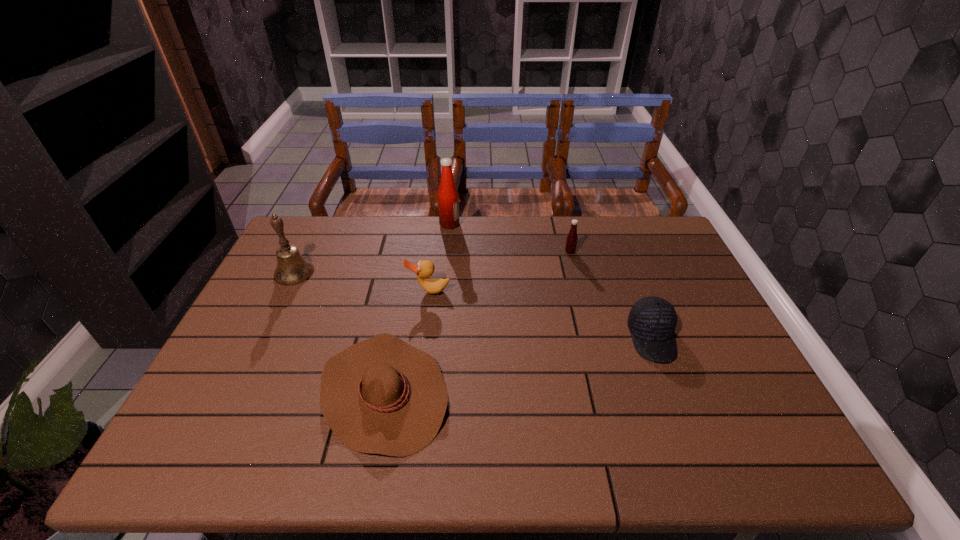
Locate an element on the screen. vacant space located 0.050m on the beak of the duck is located at coordinates (426, 309).

This screenshot has width=960, height=540. I want to click on free space located at the front of the rightmost object where the brim is located, so click(x=684, y=422).

Locate an element on the screen. This screenshot has height=540, width=960. vacant space located 0.250m on the right of the cowboy hat is located at coordinates (553, 392).

Locate an element on the screen. The height and width of the screenshot is (540, 960). condiment that is at the far edge is located at coordinates (448, 198).

I want to click on Tabasco sauce that is at the far edge, so click(x=571, y=241).

Locate an element on the screen. This screenshot has height=540, width=960. object situated at the near edge is located at coordinates (383, 396).

Find the location of a particular element. object located in the left edge section of the desktop is located at coordinates (292, 268).

At what (x,y) coordinates should I click in order to perform the action: click on object positioned at the right edge. Please return your answer as a coordinate pair (x, y). The width and height of the screenshot is (960, 540). Looking at the image, I should click on (652, 320).

In the image, there is a desktop. At what (x,y) coordinates should I click in order to perform the action: click on vacant space at the far edge. Please return your answer as a coordinate pair (x, y). The height and width of the screenshot is (540, 960). Looking at the image, I should click on (396, 225).

The image size is (960, 540). In order to click on vacant region at the near edge of the desktop in this screenshot , I will do `click(303, 461)`.